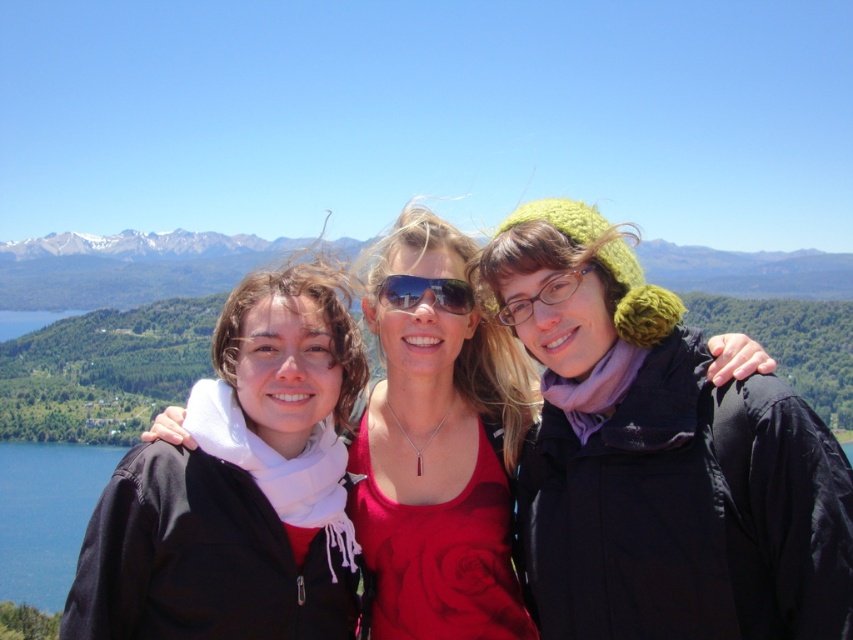
You are trying to locate the shiny blue sunglasses at center in a group photo of three people. The photo shows them standing outdoors with a lake on the left and mountains in the distance. You know there is also a matte black jacket at center. Based on their positions, which object is positioned to the left?

The shiny blue sunglasses at center are positioned to the left of the matte black jacket at center.

You are a photographer trying to capture a group photo of the knitted green hat at center and the shiny blue sunglasses at center. Since you want to ensure both items are clearly visible, which object should you focus on first to account for their size difference?

The knitted green hat at center is larger in width than the shiny blue sunglasses at center, so focus on the knitted green hat at center first to ensure its details are captured clearly.

You are trying to locate the knitted green hat at center in the image. According to the coordinates provided, where exactly is it positioned?

The knitted green hat at center is located at point coordinates of (659, 458).